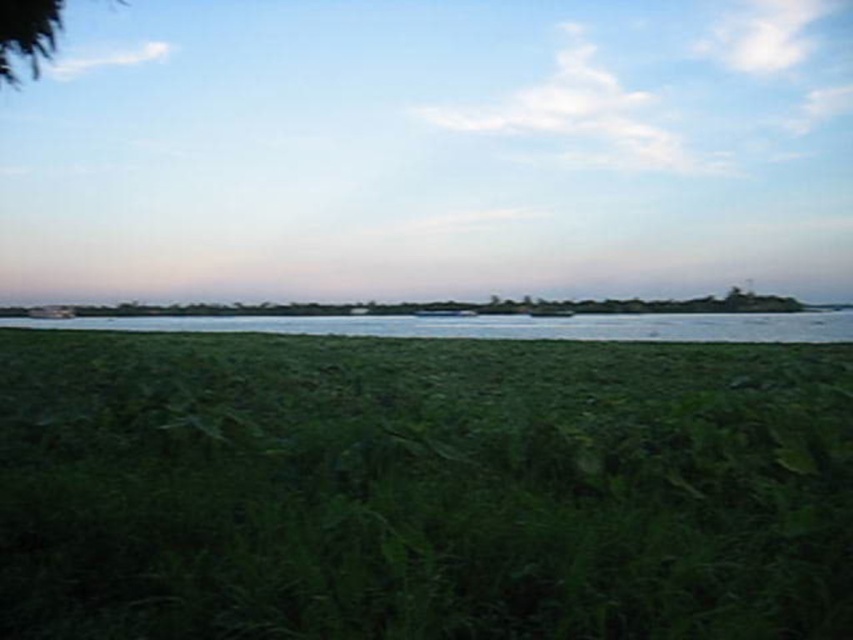
You are standing in the middle of the green matte grass at center and want to take a photo of the green leafy tree at upper left. Since the grass is shorter than the tree, will you be able to see the entire tree without any obstruction?

The green matte grass at center is shorter than the green leafy tree at upper left, so yes, you can see the entire tree without obstruction from the grass.

From the picture: You are standing at the center of the image and want to place a small decorative rock exactly where the green matte grass at center is located. According to the coordinates provided, what are the coordinates where you should place the rock?

The coordinates for the green matte grass at center are point (421, 488), so you should place the rock at those coordinates.